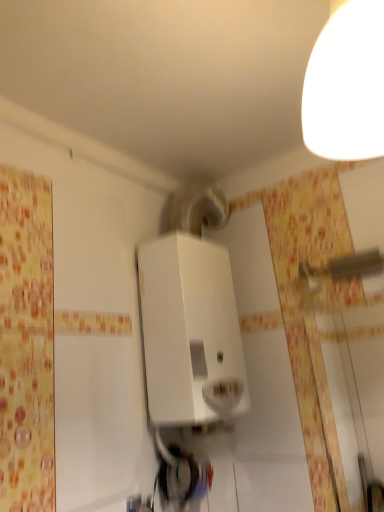
Question: Is white glossy lampshade at upper right closer to the viewer compared to white matte water heater at center?

Choices:
 (A) yes
 (B) no

Answer: (A)

Question: Is white glossy lampshade at upper right next to white matte water heater at center?

Choices:
 (A) yes
 (B) no

Answer: (B)

Question: Is white glossy lampshade at upper right wider than white matte water heater at center?

Choices:
 (A) no
 (B) yes

Answer: (B)

Question: Can you confirm if white glossy lampshade at upper right is shorter than white matte water heater at center?

Choices:
 (A) no
 (B) yes

Answer: (B)

Question: Is white glossy lampshade at upper right further to camera compared to white matte water heater at center?

Choices:
 (A) no
 (B) yes

Answer: (A)

Question: Is white glossy lampshade at upper right looking in the opposite direction of white matte water heater at center?

Choices:
 (A) no
 (B) yes

Answer: (A)

Question: Does white matte water heater at center have a larger size compared to white glossy lampshade at upper right?

Choices:
 (A) yes
 (B) no

Answer: (A)

Question: Does white matte water heater at center have a lesser height compared to white glossy lampshade at upper right?

Choices:
 (A) yes
 (B) no

Answer: (B)

Question: Is white glossy lampshade at upper right located within white matte water heater at center?

Choices:
 (A) no
 (B) yes

Answer: (A)

Question: Does white matte water heater at center lie behind white glossy lampshade at upper right?

Choices:
 (A) yes
 (B) no

Answer: (A)

Question: Considering the relative sizes of white matte water heater at center and white glossy lampshade at upper right in the image provided, is white matte water heater at center smaller than white glossy lampshade at upper right?

Choices:
 (A) no
 (B) yes

Answer: (A)

Question: Is there a large distance between white matte water heater at center and white glossy lampshade at upper right?

Choices:
 (A) yes
 (B) no

Answer: (B)

Question: Based on their sizes in the image, would you say white glossy lampshade at upper right is bigger or smaller than white matte water heater at center?

Choices:
 (A) big
 (B) small

Answer: (B)